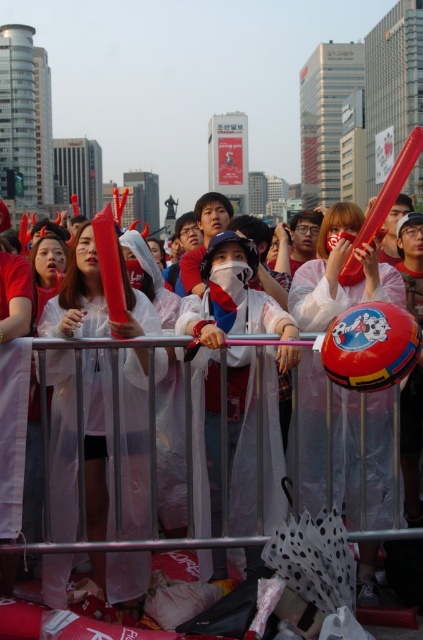
Is red glossy helmet at center positioned in front of white plastic raincoat at center?

Yes, it is.

This screenshot has height=640, width=423. What do you see at coordinates (338, 272) in the screenshot?
I see `red glossy helmet at center` at bounding box center [338, 272].

Locate an element on the screen. red glossy helmet at center is located at coordinates (338, 272).

Is point (95, 461) closer to viewer compared to point (217, 268)?

Yes, it is.

Is point (74, 358) behind point (209, 362)?

No, it is in front of (209, 362).

Which is in front, point (93, 305) or point (275, 422)?

Point (275, 422) is in front.

The image size is (423, 640). I want to click on matte red plastic tube at center, so click(x=93, y=298).

Who is positioned more to the right, red glossy helmet at center or matte red horn at center?

From the viewer's perspective, red glossy helmet at center appears more on the right side.

This screenshot has height=640, width=423. Describe the element at coordinates (338, 272) in the screenshot. I see `red glossy helmet at center` at that location.

The width and height of the screenshot is (423, 640). What are the coordinates of `red glossy helmet at center` in the screenshot? It's located at (338, 272).